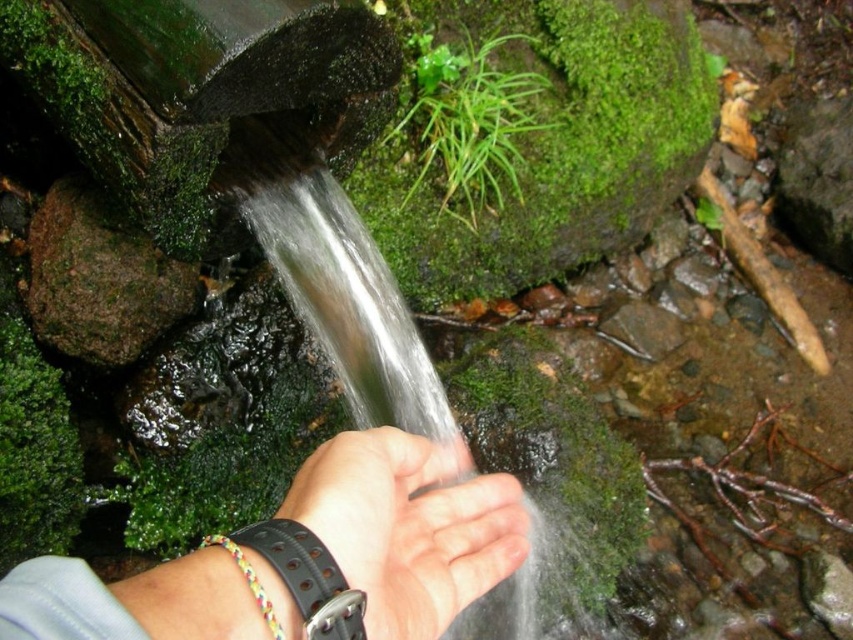
Question: Can you confirm if black leather wristband at center is positioned to the left of skinny leather wristband at lower center?

Choices:
 (A) yes
 (B) no

Answer: (A)

Question: Is black leather wristband at center in front of skinny leather wristband at lower center?

Choices:
 (A) no
 (B) yes

Answer: (B)

Question: Among these points, which one is nearest to the camera?

Choices:
 (A) pyautogui.click(x=434, y=630)
 (B) pyautogui.click(x=399, y=612)

Answer: (B)

Question: Does black leather wristband at center appear over skinny leather wristband at lower center?

Choices:
 (A) yes
 (B) no

Answer: (A)

Question: Which point is closer to the camera?

Choices:
 (A) (250, 560)
 (B) (334, 497)

Answer: (A)